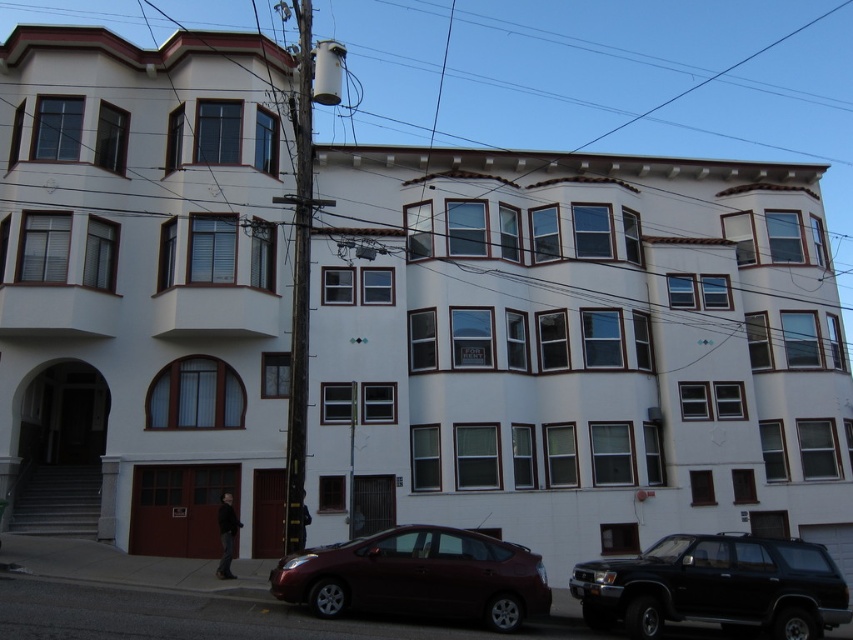
Question: Which point appears farthest from the camera in this image?

Choices:
 (A) (277, 589)
 (B) (688, 593)

Answer: (B)

Question: Is black matte suv at lower right thinner than shiny maroon sedan at lower center?

Choices:
 (A) no
 (B) yes

Answer: (B)

Question: Which point is farther to the camera?

Choices:
 (A) (721, 611)
 (B) (543, 576)

Answer: (B)

Question: Is black matte suv at lower right further to the viewer compared to shiny maroon sedan at lower center?

Choices:
 (A) yes
 (B) no

Answer: (A)

Question: Does black matte suv at lower right have a greater width compared to shiny maroon sedan at lower center?

Choices:
 (A) no
 (B) yes

Answer: (A)